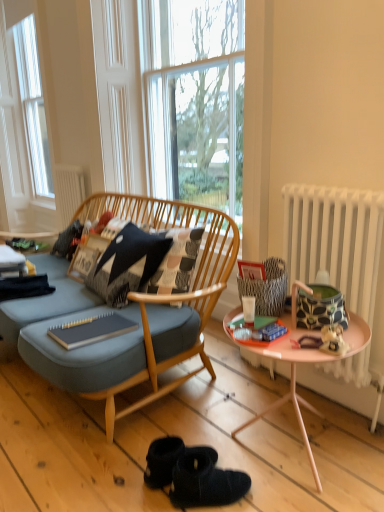
Question: Is matte green magazine at center, which ranks as the 1th magazine in front-to-back order, closer to camera compared to black textured pillow at center?

Choices:
 (A) no
 (B) yes

Answer: (B)

Question: Does matte green magazine at center, the 1th magazine in the right-to-left sequence, touch black textured pillow at center?

Choices:
 (A) no
 (B) yes

Answer: (A)

Question: Could you tell me if matte green magazine at center, the second magazine in the left-to-right sequence, is facing black textured pillow at center?

Choices:
 (A) yes
 (B) no

Answer: (B)

Question: Considering the relative positions of matte green magazine at center, which ranks as the 1th magazine in front-to-back order, and black textured pillow at center in the image provided, is matte green magazine at center, which ranks as the 1th magazine in front-to-back order, behind black textured pillow at center?

Choices:
 (A) yes
 (B) no

Answer: (B)

Question: From the image's perspective, is matte green magazine at center, the second magazine in the left-to-right sequence, under black textured pillow at center?

Choices:
 (A) no
 (B) yes

Answer: (B)

Question: From a real-world perspective, relative to clear glass window at center, is white radiator at right, which appears as the first radiator when viewed from the front, vertically above or below?

Choices:
 (A) above
 (B) below

Answer: (B)

Question: Visually, is white radiator at right, which appears as the first radiator when viewed from the front, positioned to the left or to the right of clear glass window at center?

Choices:
 (A) left
 (B) right

Answer: (B)

Question: In the image, is white radiator at right, acting as the second radiator starting from the top, positioned in front of or behind clear glass window at center?

Choices:
 (A) front
 (B) behind

Answer: (A)

Question: Considering the positions of white radiator at right, which is the first radiator in right-to-left order, and clear glass window at center in the image, is white radiator at right, which is the first radiator in right-to-left order, taller or shorter than clear glass window at center?

Choices:
 (A) tall
 (B) short

Answer: (B)

Question: From the image's perspective, is black textured pillow at center located above or below white matte radiator at upper center, the second radiator ordered from the bottom?

Choices:
 (A) below
 (B) above

Answer: (A)

Question: Looking at the image, does black textured pillow at center seem bigger or smaller compared to white matte radiator at upper center, which is the second radiator from front to back?

Choices:
 (A) big
 (B) small

Answer: (A)

Question: Is black textured pillow at center in front of or behind white matte radiator at upper center, the second radiator ordered from the bottom, in the image?

Choices:
 (A) front
 (B) behind

Answer: (A)

Question: From a real-world perspective, is black textured pillow at center physically located above or below white matte radiator at upper center, arranged as the 2th radiator when viewed from the right?

Choices:
 (A) below
 (B) above

Answer: (A)

Question: From a real-world perspective, is black textured pillow at center physically located above or below clear glass window at center?

Choices:
 (A) below
 (B) above

Answer: (A)

Question: Is point (120, 278) closer or farther from the camera than point (200, 47)?

Choices:
 (A) farther
 (B) closer

Answer: (B)